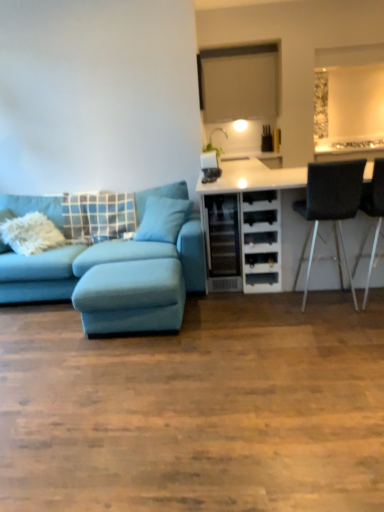
Image resolution: width=384 pixels, height=512 pixels. Find the location of `vacant area that is in front of black leather chair at right, which is the 2th chair in right-to-left order`. vacant area that is in front of black leather chair at right, which is the 2th chair in right-to-left order is located at coordinates (339, 326).